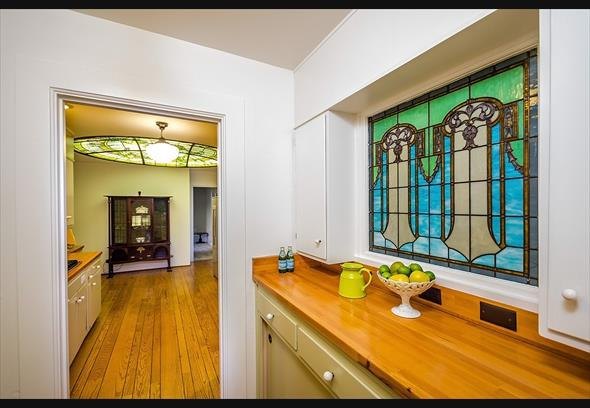
Identify the location of counter. (417, 342).